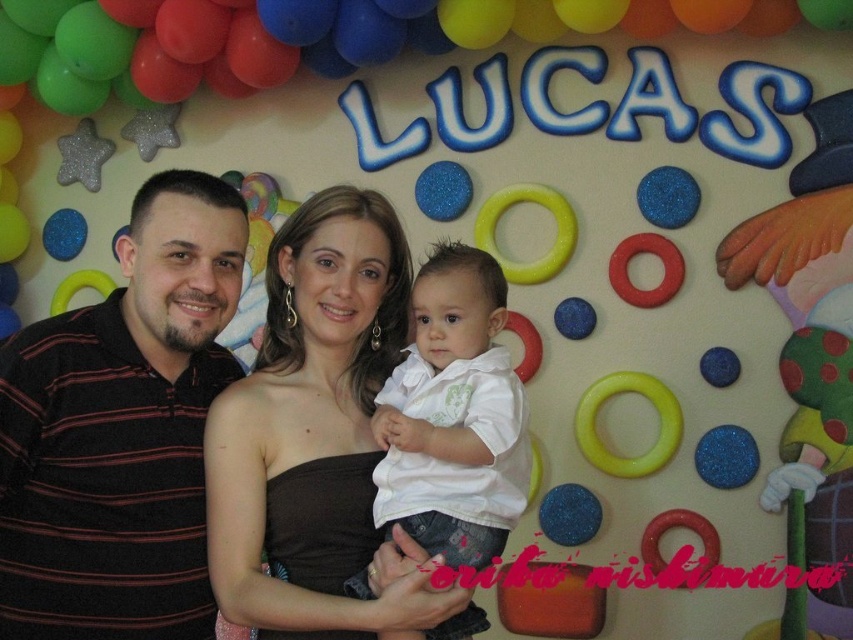
Question: Does matte white dress at center have a lesser width compared to green matte balloon at upper center?

Choices:
 (A) yes
 (B) no

Answer: (A)

Question: Is striped polo shirt at left to the left of matte white dress at center from the viewer's perspective?

Choices:
 (A) no
 (B) yes

Answer: (B)

Question: Which of these objects is positioned closest to the white matte shirt at center?

Choices:
 (A) matte white dress at center
 (B) green matte balloon at upper center
 (C) striped polo shirt at left

Answer: (A)

Question: Is striped polo shirt at left smaller than green matte balloon at upper center?

Choices:
 (A) yes
 (B) no

Answer: (A)

Question: Which point appears farthest from the camera in this image?

Choices:
 (A) click(143, 257)
 (B) click(405, 454)
 (C) click(373, 282)
 (D) click(183, 48)

Answer: (D)

Question: Among these objects, which one is farthest from the camera?

Choices:
 (A) matte white dress at center
 (B) green matte balloon at upper center

Answer: (B)